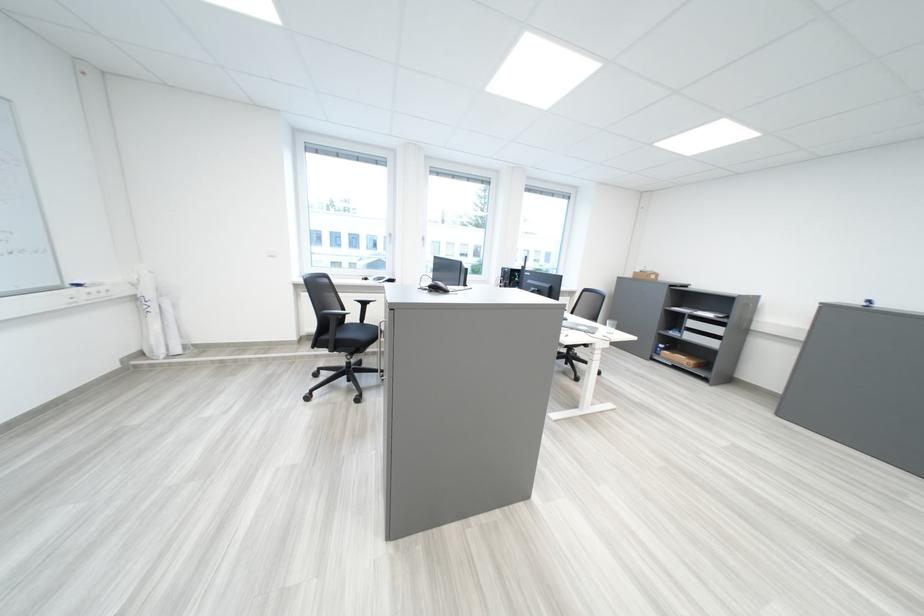
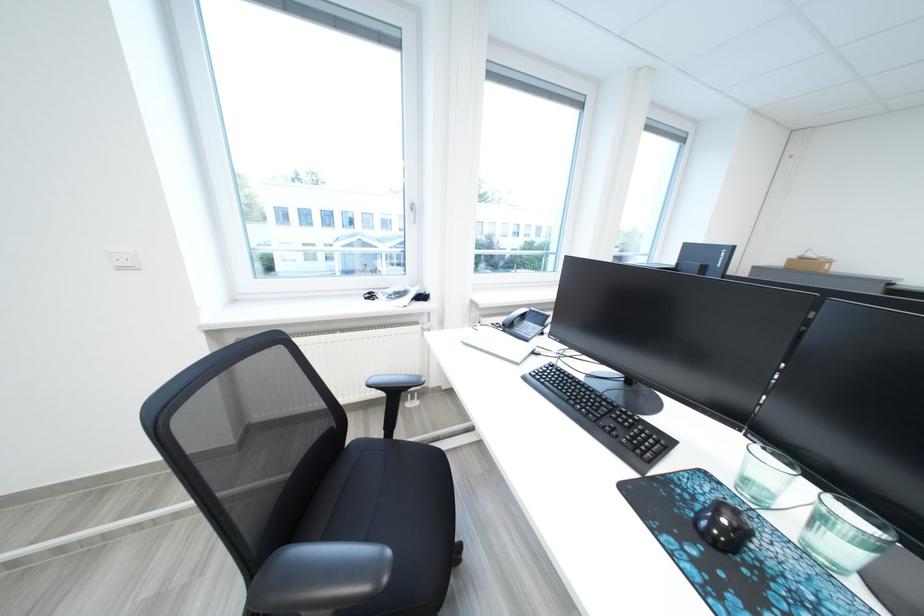
The images are taken continuously from a first-person perspective. In which direction are you moving?

The movement direction of the cameraman is left, forward.